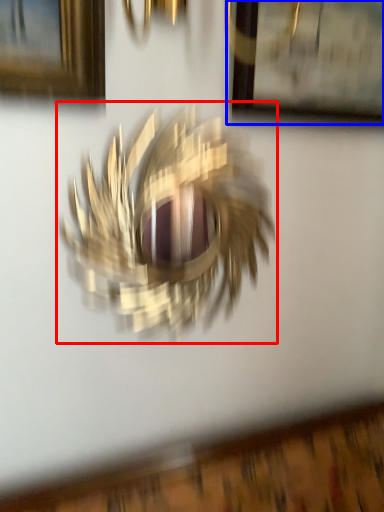
Question: Which of the following is the farthest to the observer, bird (highlighted by a red box) or picture frame (highlighted by a blue box)?

Choices:
 (A) bird
 (B) picture frame

Answer: (B)